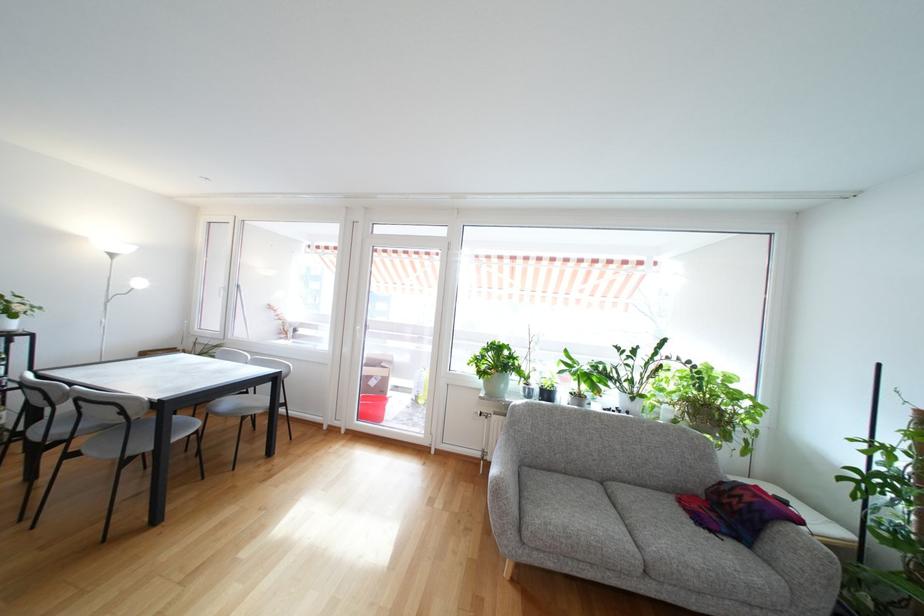
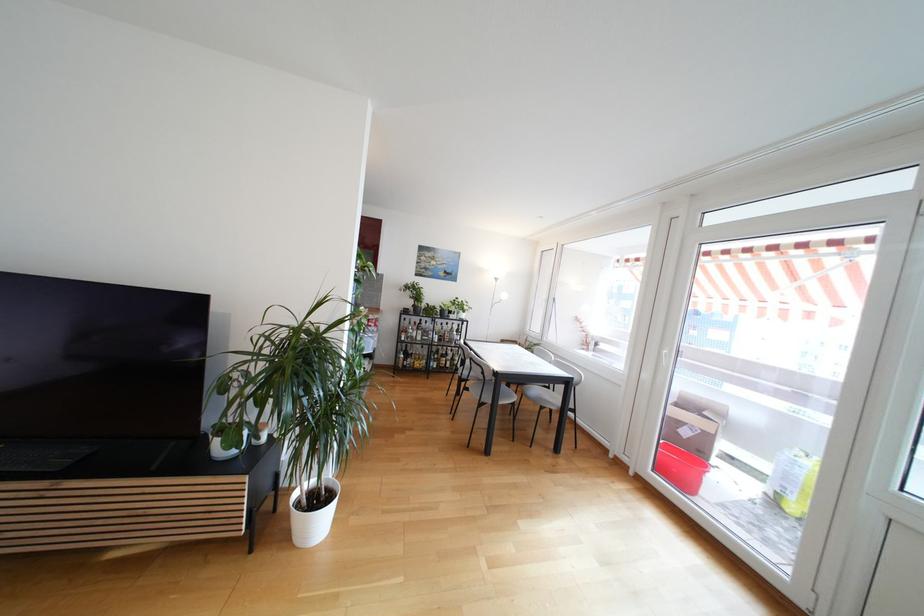
Find the pixel in the second image that matches (x=383, y=419) in the first image.

(691, 488)